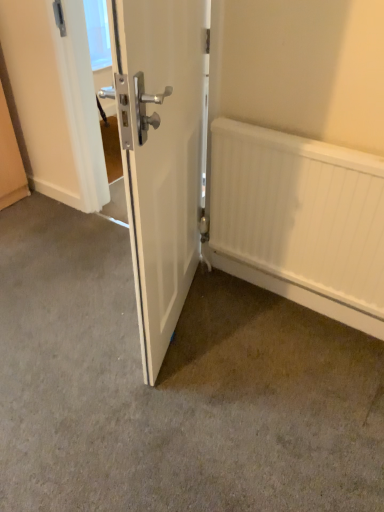
Question: Can you confirm if white matte radiator at lower right is taller than white glossy door at center?

Choices:
 (A) yes
 (B) no

Answer: (B)

Question: Does white matte radiator at lower right appear on the left side of white glossy door at center?

Choices:
 (A) no
 (B) yes

Answer: (A)

Question: From the image's perspective, is white matte radiator at lower right located beneath white glossy door at center?

Choices:
 (A) no
 (B) yes

Answer: (B)

Question: From a real-world perspective, does white matte radiator at lower right sit lower than white glossy door at center?

Choices:
 (A) yes
 (B) no

Answer: (A)

Question: Is the depth of white matte radiator at lower right greater than that of white glossy door at center?

Choices:
 (A) no
 (B) yes

Answer: (B)

Question: In terms of size, does smooth concrete floor at center appear bigger or smaller than white matte radiator at lower right?

Choices:
 (A) small
 (B) big

Answer: (B)

Question: From the image's perspective, is smooth concrete floor at center positioned above or below white matte radiator at lower right?

Choices:
 (A) below
 (B) above

Answer: (A)

Question: From a real-world perspective, is smooth concrete floor at center physically located above or below white matte radiator at lower right?

Choices:
 (A) above
 (B) below

Answer: (B)

Question: Considering their positions, is smooth concrete floor at center located in front of or behind white matte radiator at lower right?

Choices:
 (A) behind
 (B) front

Answer: (B)

Question: From the image's perspective, is white matte radiator at lower right located above or below white glossy door at center?

Choices:
 (A) above
 (B) below

Answer: (B)

Question: In terms of size, does white matte radiator at lower right appear bigger or smaller than white glossy door at center?

Choices:
 (A) big
 (B) small

Answer: (B)

Question: Is point (297, 188) closer or farther from the camera than point (112, 64)?

Choices:
 (A) closer
 (B) farther

Answer: (B)

Question: From their relative heights in the image, would you say white matte radiator at lower right is taller or shorter than white glossy door at center?

Choices:
 (A) short
 (B) tall

Answer: (A)

Question: Considering the positions of point (291, 178) and point (294, 359), is point (291, 178) closer or farther from the camera than point (294, 359)?

Choices:
 (A) closer
 (B) farther

Answer: (A)

Question: In the image, is white matte radiator at lower right on the left side or the right side of smooth concrete floor at center?

Choices:
 (A) right
 (B) left

Answer: (A)